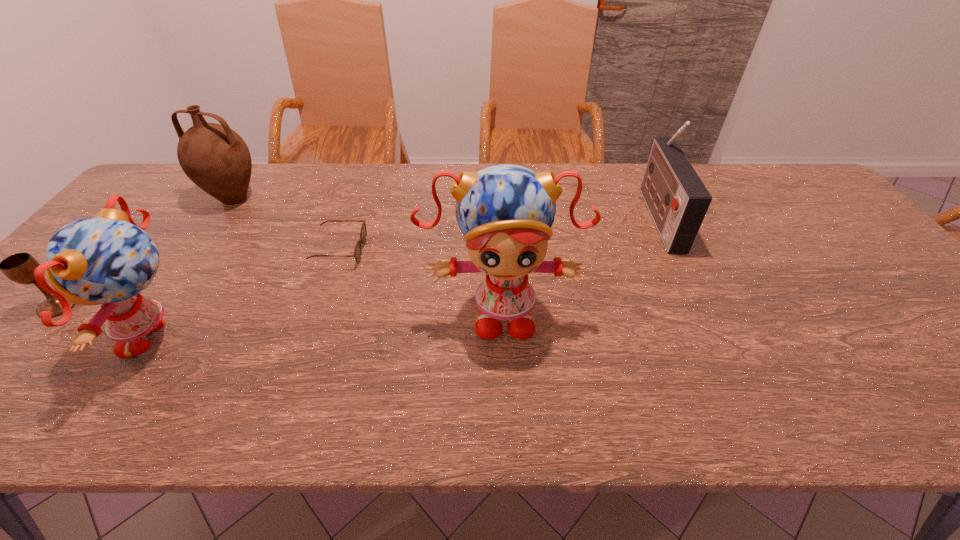
Where is `object at the left edge`? object at the left edge is located at coordinates (19, 267).

I want to click on free spot at the far edge of the desktop, so click(x=426, y=205).

Find the location of `vacant space at the near edge`. vacant space at the near edge is located at coordinates (260, 369).

Locate an element on the screen. The width and height of the screenshot is (960, 540). vacant space at the far left corner of the desktop is located at coordinates (167, 173).

Locate an element on the screen. This screenshot has width=960, height=540. vacant region between the shorter doll and the fourth object from left to right is located at coordinates (252, 294).

Find the location of a particular element. Image resolution: width=960 pixels, height=540 pixels. vacant space in between the radio receiver and the left doll is located at coordinates (411, 276).

Where is `free space between the tallest object and the third object from right to left`? free space between the tallest object and the third object from right to left is located at coordinates (420, 280).

In order to click on vacant space that's between the pitcher and the left doll in this screenshot , I will do `click(199, 268)`.

Locate an element on the screen. vacant point located between the pitcher and the shorter doll is located at coordinates (199, 268).

Locate which object ranks fifth in proximity to the third object from right to left. Please provide its 2D coordinates. Your answer should be formatted as a tuple, i.e. [(x, y)], where the tuple contains the x and y coordinates of a point satisfying the conditions above.

[(677, 199)]